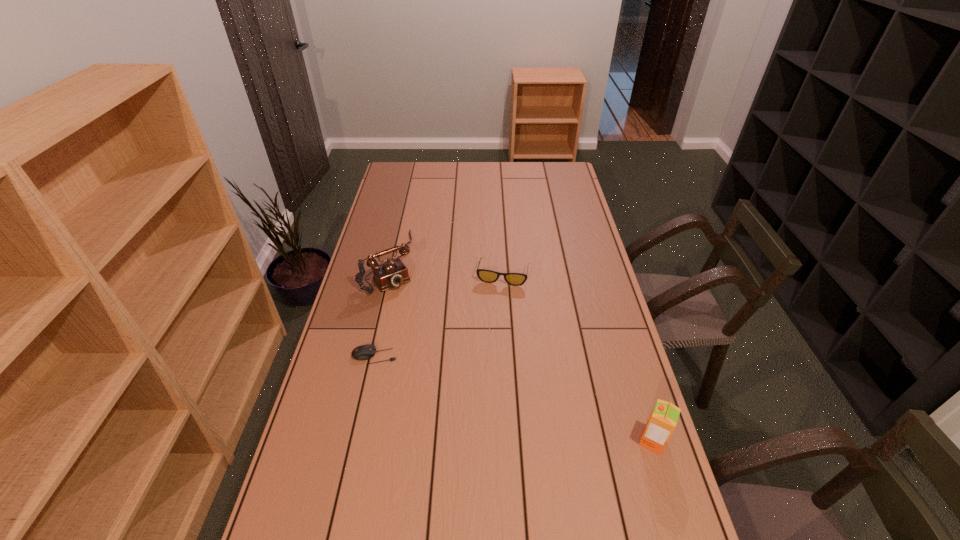
Locate an element on the screen. Image resolution: width=960 pixels, height=540 pixels. vacant point located 0.100m on the front-facing side of the second shortest object is located at coordinates (495, 307).

Find the location of a particular element. This screenshot has height=540, width=960. vacant area situated on the front-facing side of the second shortest object is located at coordinates (486, 352).

What are the coordinates of `blank area located on the dial of the telephone` in the screenshot? It's located at (413, 314).

You are a GUI agent. You are given a task and a screenshot of the screen. Output one action in this format:
    pyautogui.click(x=<x>, y=<y>)
    Task: Click on the vacant space located 0.390m on the dial of the telephone
    This screenshot has width=960, height=540.
    Given the screenshot: What is the action you would take?
    pyautogui.click(x=450, y=367)

I want to click on free space located 0.150m on the dial of the telephone, so point(416,318).

The width and height of the screenshot is (960, 540). I want to click on mouse situated at the left edge, so click(364, 352).

Image resolution: width=960 pixels, height=540 pixels. Find the location of `telephone that is at the left edge`. telephone that is at the left edge is located at coordinates (393, 273).

Identify the location of object that is at the right edge. (663, 419).

Locate an element on the screen. vacant area at the far edge is located at coordinates (471, 177).

At what (x,y) coordinates should I click in order to perform the action: click on vacant area at the near edge of the desktop. Please return your answer as a coordinate pair (x, y). Looking at the image, I should click on (414, 530).